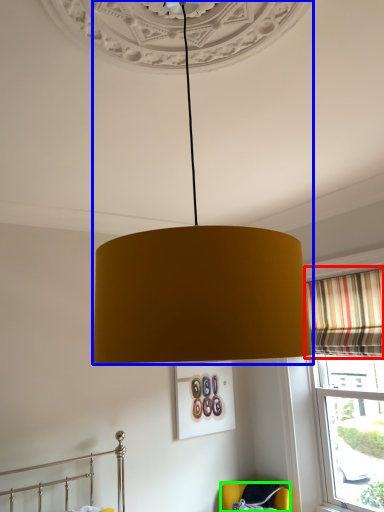
Question: Which object is the closest to the curtain (highlighted by a red box)? Choose among these: lamp (highlighted by a blue box) or furniture (highlighted by a green box).

Choices:
 (A) lamp
 (B) furniture

Answer: (B)